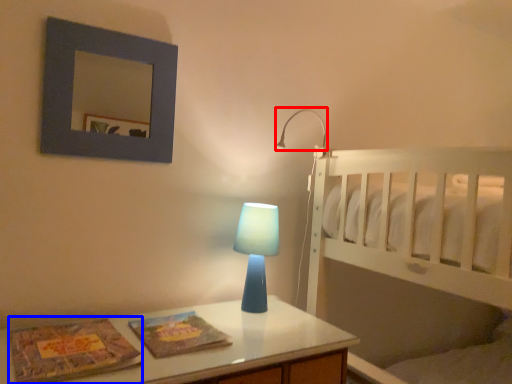
Question: Which of the following is the closest to the observer, lamp (highlighted by a red box) or magazine (highlighted by a blue box)?

Choices:
 (A) lamp
 (B) magazine

Answer: (B)